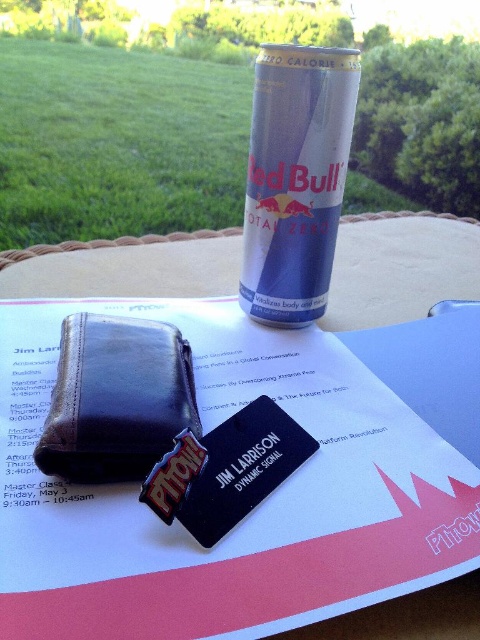
You are organizing a conference and need to place a 6.5 inches wide name tag on the table. There is a brown leather wallet at upper left and a blue metallic red bull can at upper center. Can you fit the name tag between them without moving either object?

The brown leather wallet at upper left is 6.36 inches from the blue metallic red bull can at upper center. Since the name tag is 6.5 inches wide, which is slightly longer than the space between them, it won

You are organizing a conference table and need to access the name tag under the blue metallic red bull can at upper center. However, the brown leather wallet at upper left is blocking your view. Which object should you move first to reveal the name tag?

The blue metallic red bull can at upper center is behind the brown leather wallet at upper left, so you should move the brown leather wallet at upper left first to reveal the name tag underneath.

You are holding a camera and want to take a photo of the brown leather wallet at upper left. If your camera requires the subject to be at least 30 inches away for clear focus, will the current distance of 34.29 inches work?

The distance between the brown leather wallet at upper left and the camera is 34.29 inches, which is greater than the minimum required 30 inches. Therefore, the current distance will allow for a clear focused photo.